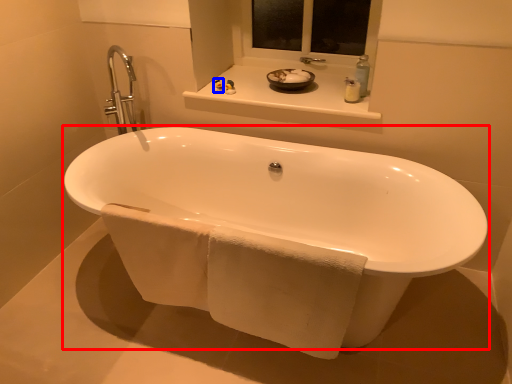
Question: Which of the following is the closest to the observer, bathtub (highlighted by a red box) or toiletry (highlighted by a blue box)?

Choices:
 (A) bathtub
 (B) toiletry

Answer: (A)